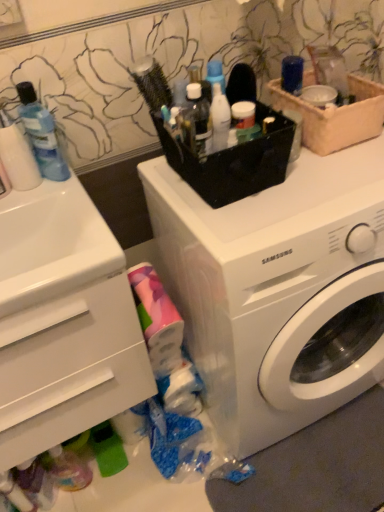
Question: Considering the positions of white plastic drawer at lower left and white plastic washing machine at center in the image, is white plastic drawer at lower left taller or shorter than white plastic washing machine at center?

Choices:
 (A) short
 (B) tall

Answer: (A)

Question: Based on their sizes in the image, would you say white plastic drawer at lower left is bigger or smaller than white plastic washing machine at center?

Choices:
 (A) small
 (B) big

Answer: (A)

Question: Which object is the farthest from the white glossy sink at left?

Choices:
 (A) white plastic washing machine at center
 (B) blue matte bottle at upper left
 (C) white plastic drawer at lower left
 (D) translucent plastic bottle at center, which is counted as the second toiletry, starting from the left
 (E) translucent plastic bottles at center, which ranks as the first toiletry in left-to-right order

Answer: (D)

Question: Estimate the real-world distances between objects in this image. Which object is closer to the translucent plastic bottle at center, the 1th toiletry in the right-to-left sequence?

Choices:
 (A) translucent plastic bottles at center, positioned as the 2th toiletry in right-to-left order
 (B) blue matte bottle at upper left
 (C) white plastic drawer at lower left
 (D) white glossy sink at left
 (E) beige woven basket at upper right

Answer: (A)